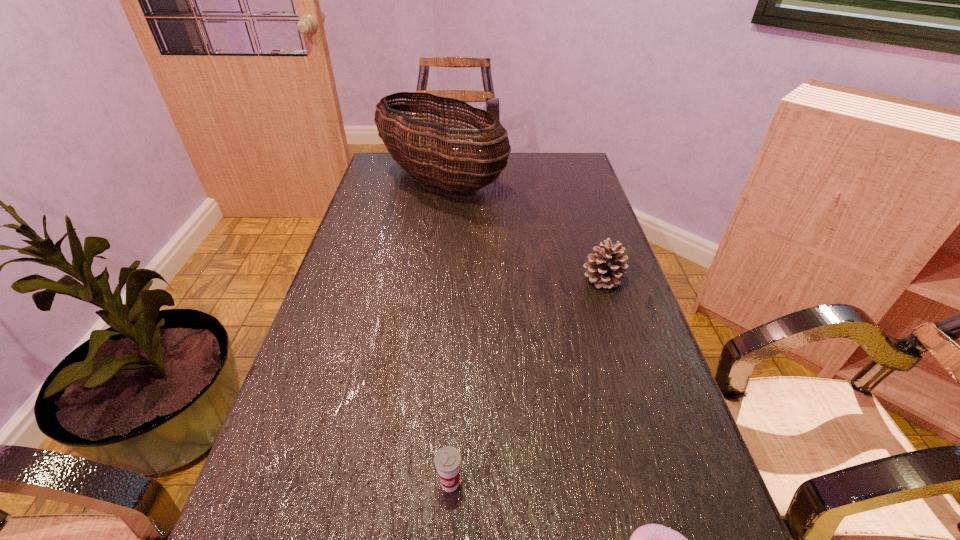
Locate an element on the screen. The height and width of the screenshot is (540, 960). object at the far left corner is located at coordinates (405, 144).

In the image, there is a desktop. At what (x,y) coordinates should I click in order to perform the action: click on vacant space at the left edge. Please return your answer as a coordinate pair (x, y). Looking at the image, I should click on (339, 343).

In the image, there is a desktop. At what (x,y) coordinates should I click in order to perform the action: click on vacant space at the right edge. Please return your answer as a coordinate pair (x, y). The image size is (960, 540). Looking at the image, I should click on (562, 202).

Find the location of `vacant space at the far left corner of the desktop`. vacant space at the far left corner of the desktop is located at coordinates (391, 154).

The image size is (960, 540). In the image, there is a desktop. Identify the location of free space at the far right corner. (567, 165).

What are the coordinates of `empty space between the farthest object and the third farthest object` in the screenshot? It's located at (445, 332).

The image size is (960, 540). I want to click on free point between the farthest object and the cup, so click(x=445, y=332).

I want to click on vacant point located between the third nearest object and the cup, so (x=526, y=381).

Where is `free space between the cup and the farthest object`? The height and width of the screenshot is (540, 960). free space between the cup and the farthest object is located at coordinates (445, 332).

This screenshot has width=960, height=540. I want to click on free space between the pinecone and the second nearest object, so click(x=526, y=381).